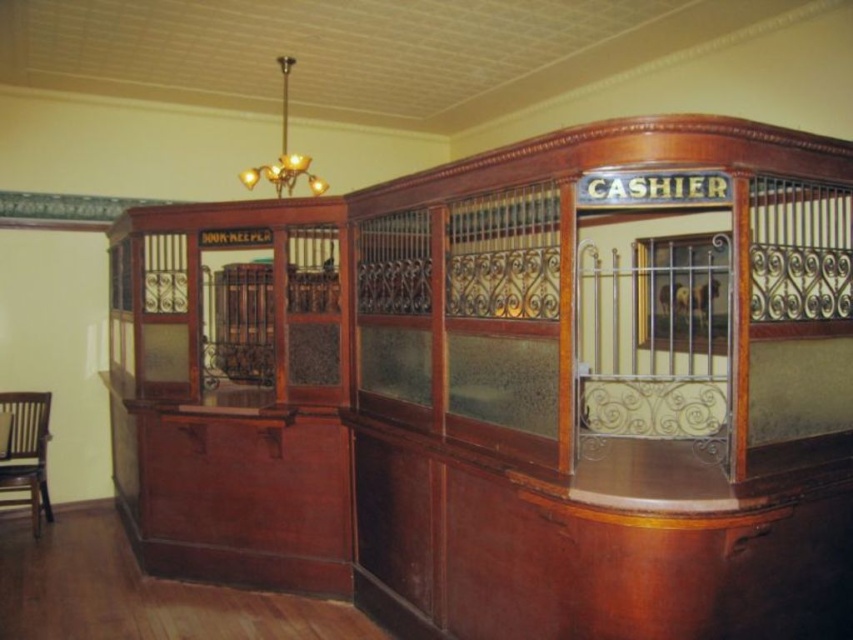
Which is in front, point (39, 419) or point (283, 116)?

Positioned in front is point (39, 419).

Which is below, wooden chair at lower left or gold metallic chandelier at upper center?

wooden chair at lower left is below.

Who is more distant from viewer, (33,502) or (287,99)?

Point (287,99)

Locate an element on the screen. wooden chair at lower left is located at coordinates (26, 452).